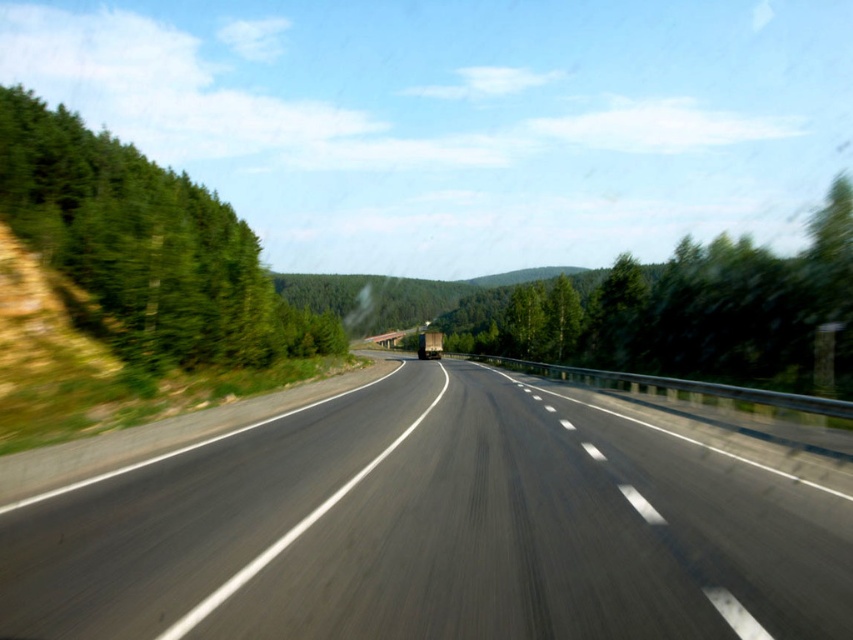
You are a passenger in the car and looking out the window. You notice two green leafy trees at left and green leafy tree at center. Which one is closer to the road?

The green leafy trees at left is closer to the road because it is located below the green leafy tree at center, indicating it is positioned lower in the visual field, which typically corresponds to being nearer when viewing from a moving vehicle.

You are driving a car and see two points marked on the road ahead. The first point is at coordinates point (459,545) and the second is at point (641,333). Which point is closer to your current position?

Point (641,333) is closer to your current position because it is behind point (459,545), which is further ahead.